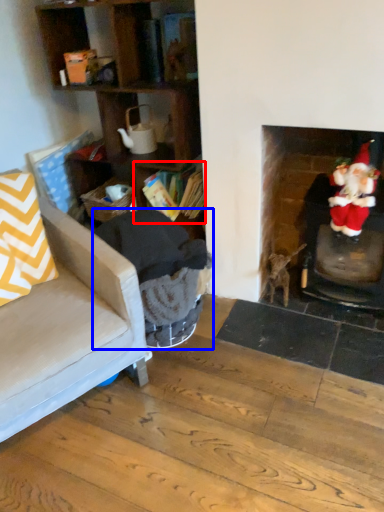
Question: Which object appears closest to the camera in this image, shelf (highlighted by a red box) or rocking chair (highlighted by a blue box)?

Choices:
 (A) shelf
 (B) rocking chair

Answer: (B)